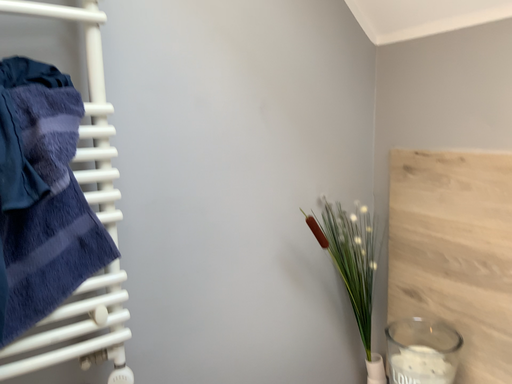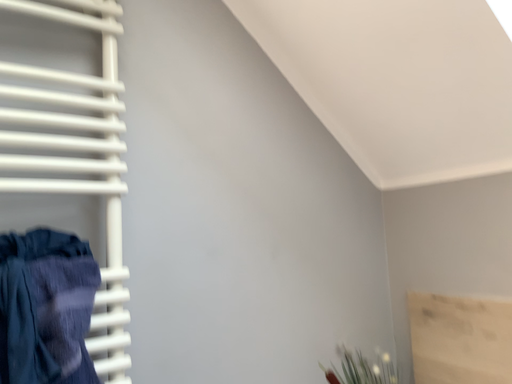
Question: How did the camera likely rotate when shooting the video?

Choices:
 (A) rotated downward
 (B) rotated upward

Answer: (B)